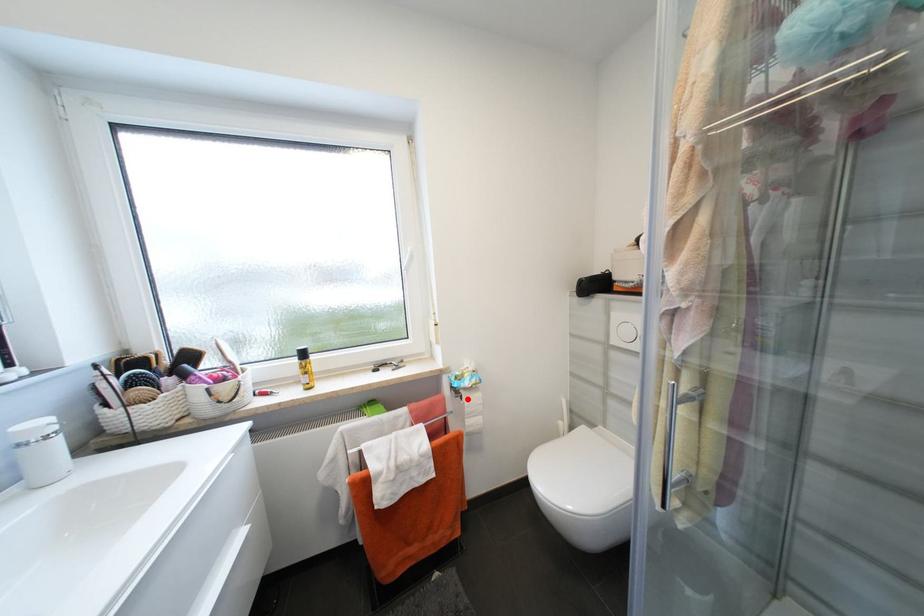
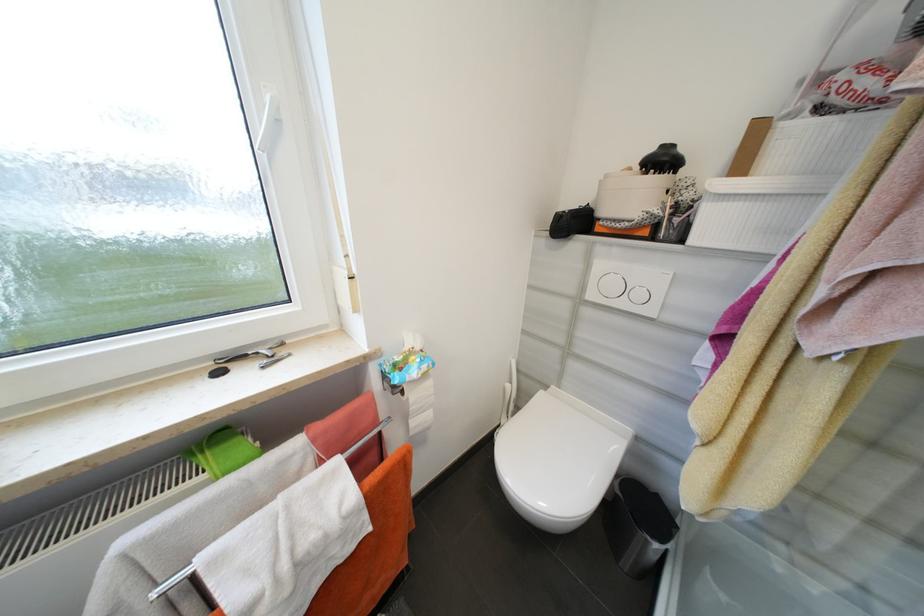
Question: I am providing you with two images of the same scene from different viewpoints. A red point is marked on the first image. Is the red point's position out of view in image 2?

Choices:
 (A) Yes
 (B) No

Answer: (B)